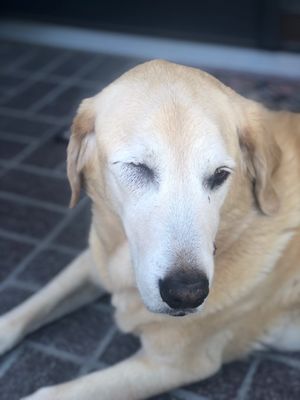
Identify the location of grey brick floor. (23, 220).